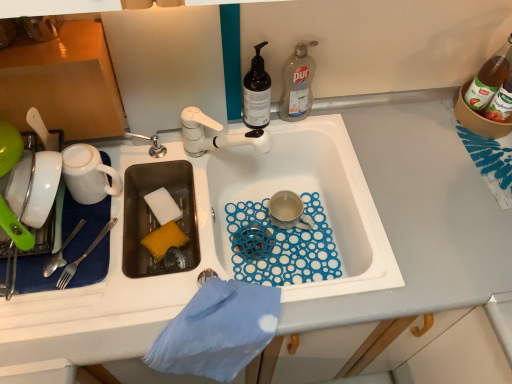
Question: From a real-world perspective, is translucent dark brown bottle at upper center, the first bottle when ordered from left to right, above or below shiny silver fork at left?

Choices:
 (A) below
 (B) above

Answer: (B)

Question: Is translucent dark brown bottle at upper center, the first bottle when ordered from left to right, inside the boundaries of shiny silver fork at left, or outside?

Choices:
 (A) inside
 (B) outside

Answer: (B)

Question: Considering the real-world distances, which object is farthest from the translucent glass bottle at upper right, the first bottle in the right-to-left sequence?

Choices:
 (A) satin silver fork at left
 (B) matte ceramic mug at center, which is the 1th coffee cup in back-to-front order
 (C) white sponge at sink left, which appears as the first food when viewed from the top
 (D) white plastic sink at center
 (E) clear plastic bottle at upper right, marked as the second bottle in a right-to-left arrangement

Answer: (A)

Question: Which is farther from the white plastic sink at center?

Choices:
 (A) clear plastic bottle at upper right, positioned as the 2th bottle in left-to-right order
 (B) yellow sponge at sink left, which is the second food in top-to-bottom order
 (C) white matte mug at upper left, marked as the 2th coffee cup in a right-to-left arrangement
 (D) translucent dark brown bottle at upper center, the first bottle when ordered from left to right
 (E) satin silver fork at left

Answer: (E)